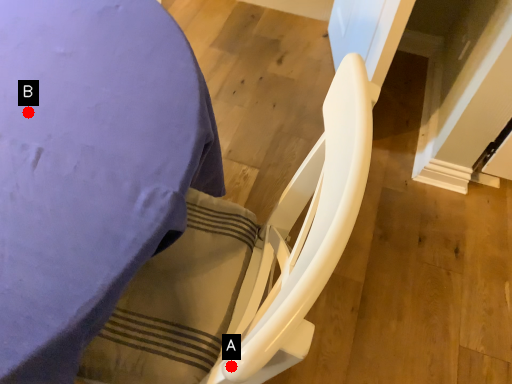
Question: Two points are circled on the image, labeled by A and B beside each circle. Which point is closer to the camera?

Choices:
 (A) A is closer
 (B) B is closer

Answer: (A)